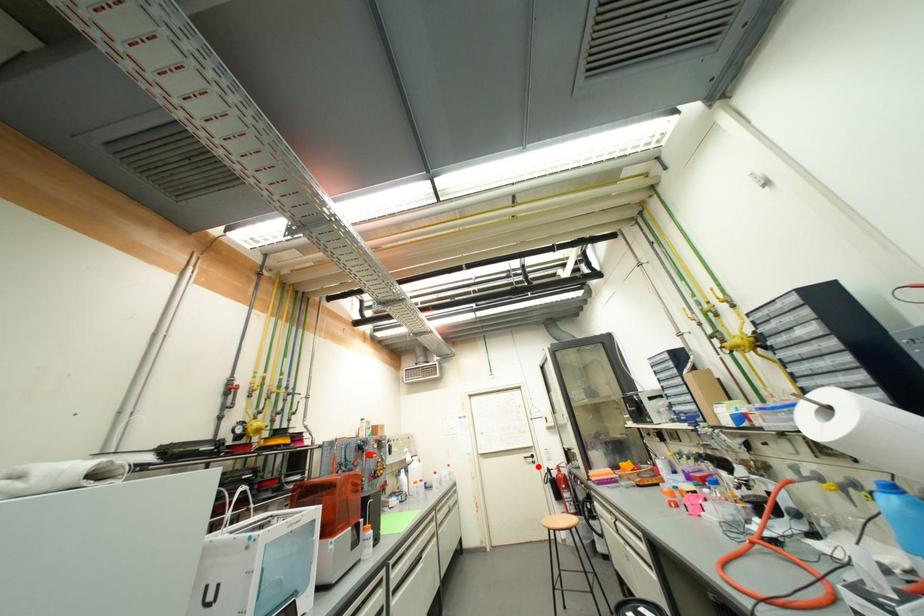
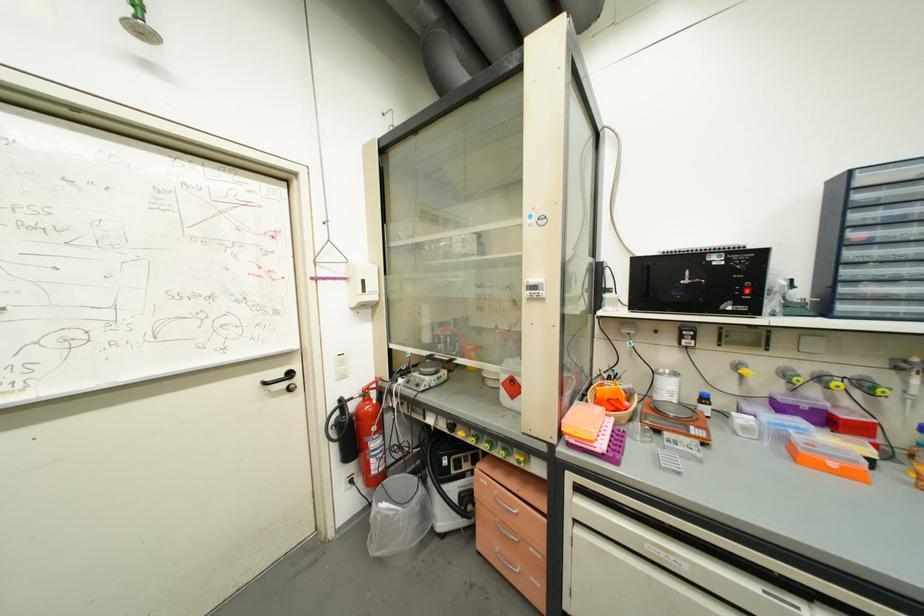
Find the pixel in the second image that matches the highlighted location in the first image.

(293, 398)